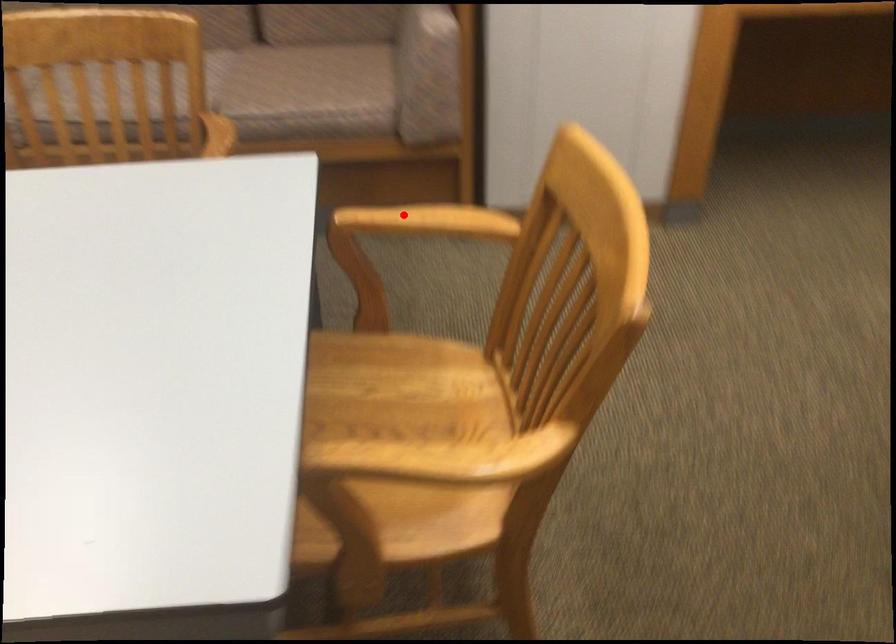
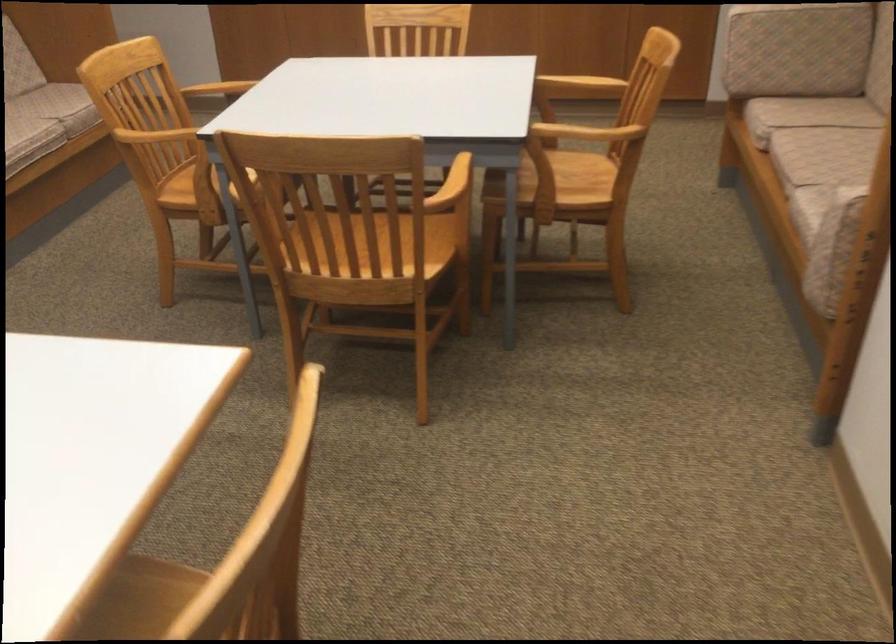
Question: I am providing you with two images of the same scene from different viewpoints. Image1 has a red point marked. In image2, the corresponding 3D location appears at what relative position? Reply with the corresponding letter.

Choices:
 (A) Closer
 (B) Farther

Answer: (B)